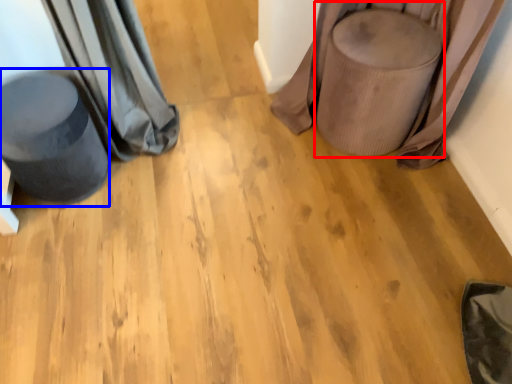
Question: Which of the following is the farthest to the observer, swivel chair (highlighted by a red box) or swivel chair (highlighted by a blue box)?

Choices:
 (A) swivel chair
 (B) swivel chair

Answer: (A)